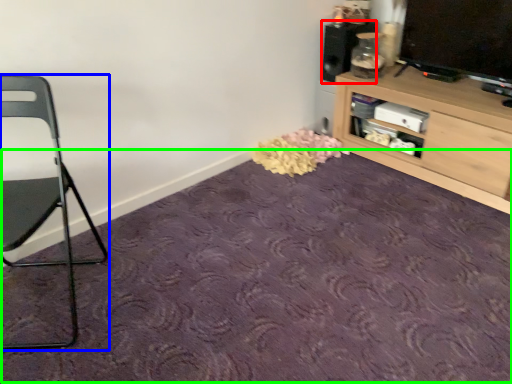
Question: Which object is the farthest from speaker (highlighted by a red box)? Choose among these: chair (highlighted by a blue box) or plain (highlighted by a green box).

Choices:
 (A) chair
 (B) plain

Answer: (A)